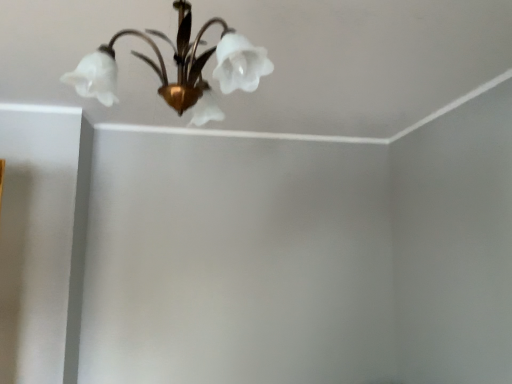
Identify the location of matte glass chandelier at upper left. The image size is (512, 384). (179, 68).

This screenshot has height=384, width=512. Describe the element at coordinates (179, 68) in the screenshot. I see `matte glass chandelier at upper left` at that location.

This screenshot has width=512, height=384. I want to click on matte glass chandelier at upper left, so click(179, 68).